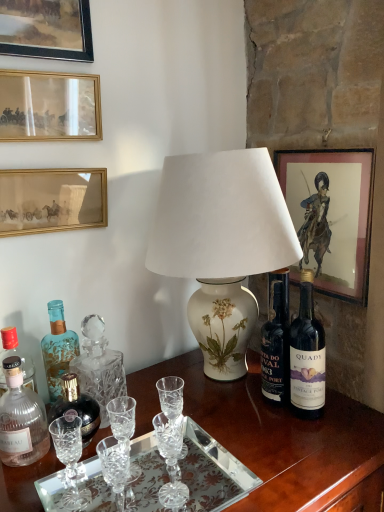
What are the coordinates of `free space in front of clear crystal wine glass at center` in the screenshot? It's located at (184, 476).